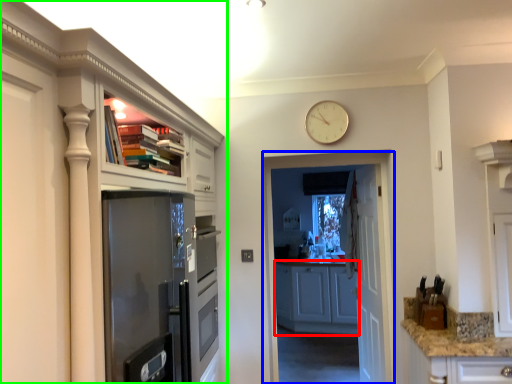
Question: Estimate the real-world distances between objects in this image. Which object is farther from cabinetry (highlighted by a red box), screen door (highlighted by a blue box) or cabinetry (highlighted by a green box)?

Choices:
 (A) screen door
 (B) cabinetry

Answer: (B)